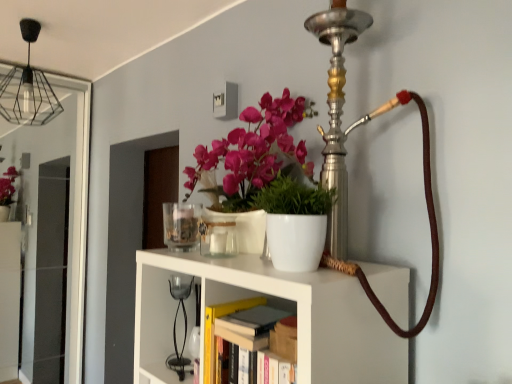
What do you see at coordinates (257, 360) in the screenshot?
I see `hardcover book at center, arranged as the third book when viewed from the back` at bounding box center [257, 360].

The image size is (512, 384). What do you see at coordinates (253, 320) in the screenshot?
I see `hardcover book at center, which appears as the second book when viewed from the back` at bounding box center [253, 320].

Locate an element on the screen. This screenshot has width=512, height=384. white matte shelf at center is located at coordinates (273, 305).

The image size is (512, 384). What do you see at coordinates (28, 88) in the screenshot? I see `matte black light bulb at upper left` at bounding box center [28, 88].

Measure the distance between point (178, 368) and camera.

Point (178, 368) is 4.47 feet from camera.

You are a GUI agent. You are given a task and a screenshot of the screen. Output one action in this format:
    pyautogui.click(x=<x>, y=<y>)
    Task: Click on the hardcover book at center, positioned as the first book in front-to-back order
    
    Given the screenshot: What is the action you would take?
    pyautogui.click(x=257, y=360)

Considering the relative positions of matte black light bulb at upper left and transparent glass candle holder at upper center in the image provided, is matte black light bulb at upper left to the left or to the right of transparent glass candle holder at upper center?

Based on their positions, matte black light bulb at upper left is located to the left of transparent glass candle holder at upper center.

Considering the positions of point (19, 82) and point (170, 223), is point (19, 82) closer or farther from the camera than point (170, 223)?

Point (19, 82) is positioned farther from the camera compared to point (170, 223).

Choose the correct answer: Is matte black light bulb at upper left inside transparent glass candle holder at upper center or outside it?

matte black light bulb at upper left lies outside transparent glass candle holder at upper center.

Considering the sizes of matte black light bulb at upper left and transparent glass candle holder at upper center in the image, is matte black light bulb at upper left taller or shorter than transparent glass candle holder at upper center?

Considering their sizes, matte black light bulb at upper left has more height than transparent glass candle holder at upper center.

Could you tell me if transparent glass candle holder at upper center is facing matte black light bulb at upper left?

No, transparent glass candle holder at upper center is not turned towards matte black light bulb at upper left.

From a real-world perspective, is transparent glass candle holder at upper center over matte black light bulb at upper left?

No, from a real-world perspective, transparent glass candle holder at upper center is not over matte black light bulb at upper left

Find the location of a particular element. The height and width of the screenshot is (384, 512). book that is the 2nd object located in front of the transparent glass candle holder at upper center is located at coordinates (253, 320).

Is hardcover book at center, marked as the second book in a front-to-back arrangement, positioned far away from transparent glass candle holder at upper center?

No, hardcover book at center, marked as the second book in a front-to-back arrangement, is not far from transparent glass candle holder at upper center.

Is hardcover book at center, marked as the second book in a front-to-back arrangement, wider than transparent glass candle holder at upper center?

No.

How different are the orientations of transparent glass candle holder at upper center and hardcover book at center, which is the third book in front-to-back order, in degrees?

There is a 1.11-degree angle between the facing directions of transparent glass candle holder at upper center and hardcover book at center, which is the third book in front-to-back order.

Is transparent glass candle holder at upper center facing away from hardcover book at center, which is the 1th book from back to front?

transparent glass candle holder at upper center is not turned away from hardcover book at center, which is the 1th book from back to front.

Consider the image. Would you say transparent glass candle holder at upper center is outside hardcover book at center, which is the 1th book from back to front?

Yes.

Is point (218, 327) closer or farther from the camera than point (320, 352)?

Point (218, 327) is farther from the camera than point (320, 352).

Does hardcover book at center, positioned as the first book in front-to-back order, have a lesser height compared to white matte shelf at center?

Correct, hardcover book at center, positioned as the first book in front-to-back order, is not as tall as white matte shelf at center.

Does hardcover book at center, positioned as the first book in front-to-back order, contain white matte shelf at center?

Actually, white matte shelf at center is outside hardcover book at center, positioned as the first book in front-to-back order.

Is the depth of transparent glass candle holder at upper center greater than that of hardcover book at center, arranged as the third book when viewed from the back?

Yes, the depth of transparent glass candle holder at upper center is greater than that of hardcover book at center, arranged as the third book when viewed from the back.

From a real-world perspective, who is located higher, transparent glass candle holder at upper center or hardcover book at center, arranged as the third book when viewed from the back?

transparent glass candle holder at upper center is physically above.

Considering the sizes of objects transparent glass candle holder at upper center and hardcover book at center, arranged as the third book when viewed from the back, in the image provided, who is bigger, transparent glass candle holder at upper center or hardcover book at center, arranged as the third book when viewed from the back,?

With larger size is hardcover book at center, arranged as the third book when viewed from the back.

Is transparent glass candle holder at upper center facing towards hardcover book at center, arranged as the third book when viewed from the back?

No, transparent glass candle holder at upper center is not turned towards hardcover book at center, arranged as the third book when viewed from the back.

From the image's perspective, is transparent glass door at left on top of hardcover book at center, which is the third book in front-to-back order?

Correct, transparent glass door at left appears higher than hardcover book at center, which is the third book in front-to-back order, in the image.

Which of these two, transparent glass door at left or hardcover book at center, which is the third book in front-to-back order, is smaller?

hardcover book at center, which is the third book in front-to-back order.

Where is `glass door behind the hardcover book at center, which is the third book in front-to-back order`? This screenshot has height=384, width=512. glass door behind the hardcover book at center, which is the third book in front-to-back order is located at coordinates (69, 199).

Between transparent glass door at left and hardcover book at center, which is the third book in front-to-back order, which one has larger width?

hardcover book at center, which is the third book in front-to-back order.

You are a GUI agent. You are given a task and a screenshot of the screen. Output one action in this format:
    pyautogui.click(x=<x>, y=<y>)
    Task: Click on the candle holder located on the right of matte black light bulb at upper left
    The width and height of the screenshot is (512, 384).
    Given the screenshot: What is the action you would take?
    pyautogui.click(x=181, y=225)

The width and height of the screenshot is (512, 384). I want to click on lamp located behind the transparent glass candle holder at upper center, so click(28, 88).

Considering their positions, is hardcover book at center, which is the 1th book from back to front, positioned further to matte black light bulb at upper left than transparent glass door at left?

hardcover book at center, which is the 1th book from back to front.

Estimate the real-world distances between objects in this image. Which object is closer to hardcover book at center, marked as the second book in a front-to-back arrangement, matte black light bulb at upper left or hardcover book at center, which is the 1th book from back to front?

hardcover book at center, which is the 1th book from back to front.

Considering their positions, is hardcover book at center, positioned as the first book in front-to-back order, positioned closer to hardcover book at center, which appears as the second book when viewed from the back, than hardcover book at center, which is the 1th book from back to front?

hardcover book at center, which is the 1th book from back to front, is positioned closer to the anchor hardcover book at center, which appears as the second book when viewed from the back.

Based on their spatial positions, is hardcover book at center, marked as the second book in a front-to-back arrangement, or transparent glass door at left further from black glass table lamp at center?

transparent glass door at left is further to black glass table lamp at center.

Based on their spatial positions, is transparent glass door at left or white matte shelf at center closer to matte black light bulb at upper left?

transparent glass door at left is closer to matte black light bulb at upper left.

Looking at this image, considering their positions, is hardcover book at center, positioned as the first book in front-to-back order, positioned further to hardcover book at center, which appears as the second book when viewed from the back, than black glass table lamp at center?

black glass table lamp at center lies further to hardcover book at center, which appears as the second book when viewed from the back, than the other object.

Estimate the real-world distances between objects in this image. Which object is further from hardcover book at center, which appears as the second book when viewed from the back, hardcover book at center, which is the 1th book from back to front, or black glass table lamp at center?

black glass table lamp at center.

When comparing their distances from white matte shelf at center, does hardcover book at center, which is the 1th book from back to front, or black glass table lamp at center seem closer?

hardcover book at center, which is the 1th book from back to front.

This screenshot has height=384, width=512. Identify the location of table lamp positioned between white matte shelf at center and transparent glass door at left from near to far. (176, 322).

Image resolution: width=512 pixels, height=384 pixels. I want to click on candle holder between matte black light bulb at upper left and black glass table lamp at center from top to bottom, so click(181, 225).

The width and height of the screenshot is (512, 384). What are the coordinates of `candle holder between matte black light bulb at upper left and white matte shelf at center from left to right` in the screenshot? It's located at (181, 225).

This screenshot has height=384, width=512. In order to click on table lamp between transparent glass door at left and hardcover book at center, which is the 1th book from back to front, in the horizontal direction in this screenshot , I will do `click(176, 322)`.